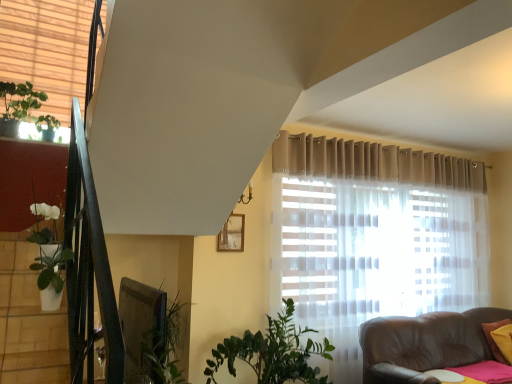
Where is `yellow fabric pillow at lower right`? This screenshot has height=384, width=512. yellow fabric pillow at lower right is located at coordinates (493, 340).

Measure the distance between white glossy pot at left and camera.

The distance of white glossy pot at left from camera is 2.20 meters.

This screenshot has height=384, width=512. Find the location of `beige fabric blinds at upper left`. beige fabric blinds at upper left is located at coordinates (47, 51).

Is yellow fabric pillow at lower right positioned behind green matte plant at upper left?

Yes, yellow fabric pillow at lower right is further from the camera.

Is yellow fabric pillow at lower right taller than green matte plant at upper left?

Incorrect, the height of yellow fabric pillow at lower right is not larger of that of green matte plant at upper left.

Image resolution: width=512 pixels, height=384 pixels. What are the coordinates of `pillow beneath the green matte plant at upper left (from a real-world perspective)` in the screenshot? It's located at (493, 340).

Which is more to the left, yellow fabric pillow at lower right or green matte plant at upper left?

green matte plant at upper left is more to the left.

Considering the relative sizes of green matte plant at upper left and beige fabric blinds at upper left in the image provided, is green matte plant at upper left wider than beige fabric blinds at upper left?

No, green matte plant at upper left is not wider than beige fabric blinds at upper left.

Considering the relative sizes of green matte plant at upper left and beige fabric blinds at upper left in the image provided, is green matte plant at upper left shorter than beige fabric blinds at upper left?

Yes, green matte plant at upper left is shorter than beige fabric blinds at upper left.

Considering the relative positions of green matte plant at upper left and beige fabric blinds at upper left in the image provided, is green matte plant at upper left to the right of beige fabric blinds at upper left from the viewer's perspective?

No, green matte plant at upper left is not to the right of beige fabric blinds at upper left.

Is beige fabric blinds at upper left completely or partially inside green matte plant at upper left?

Definitely not — beige fabric blinds at upper left is not inside green matte plant at upper left.

Who is taller, wooden frame at upper center or yellow fabric pillow at lower right?

With more height is yellow fabric pillow at lower right.

Who is bigger, wooden frame at upper center or yellow fabric pillow at lower right?

Bigger between the two is yellow fabric pillow at lower right.

How many degrees apart are the facing directions of wooden frame at upper center and yellow fabric pillow at lower right?

There is a 8.17-degree angle between the facing directions of wooden frame at upper center and yellow fabric pillow at lower right.

Is wooden frame at upper center facing away from green matte plant at upper left?

wooden frame at upper center is not turned away from green matte plant at upper left.

Considering the relative positions of wooden frame at upper center and green matte plant at upper left in the image provided, is wooden frame at upper center to the right of green matte plant at upper left from the viewer's perspective?

Yes.

Is the position of wooden frame at upper center less distant than that of green matte plant at upper left?

No, wooden frame at upper center is behind green matte plant at upper left.

In the scene shown: From a real-world perspective, is wooden frame at upper center on green matte plant at upper left?

No, from a real-world perspective, wooden frame at upper center is not over green matte plant at upper left

Is white glossy pot at left to the left of beige fabric blinds at upper left from the viewer's perspective?

In fact, white glossy pot at left is to the right of beige fabric blinds at upper left.

Considering the sizes of objects white glossy pot at left and beige fabric blinds at upper left in the image provided, who is bigger, white glossy pot at left or beige fabric blinds at upper left?

beige fabric blinds at upper left.

Who is taller, white glossy pot at left or beige fabric blinds at upper left?

Standing taller between the two is beige fabric blinds at upper left.

Which is behind, white glossy pot at left or beige fabric blinds at upper left?

beige fabric blinds at upper left is further away from the camera.

Is beige fabric blinds at upper left positioned far away from wooden frame at upper center?

beige fabric blinds at upper left is positioned a significant distance from wooden frame at upper center.

Which of these two, beige fabric blinds at upper left or wooden frame at upper center, is wider?

With larger width is beige fabric blinds at upper left.

Is point (103, 2) behind point (226, 247)?

No, (103, 2) is in front of (226, 247).

Considering the relative positions of beige fabric blinds at upper left and wooden frame at upper center in the image provided, is beige fabric blinds at upper left to the left or to the right of wooden frame at upper center?

beige fabric blinds at upper left is positioned on wooden frame at upper center's left side.

Based on their positions, is white glossy pot at left located to the left or right of yellow fabric pillow at lower right?

Clearly, white glossy pot at left is on the left of yellow fabric pillow at lower right in the image.

Is white glossy pot at left in contact with yellow fabric pillow at lower right?

No, white glossy pot at left is not with yellow fabric pillow at lower right.

Is white glossy pot at left inside or outside of yellow fabric pillow at lower right?

white glossy pot at left lies outside yellow fabric pillow at lower right.

Is white glossy pot at left turned away from yellow fabric pillow at lower right?

white glossy pot at left is not turned away from yellow fabric pillow at lower right.

This screenshot has width=512, height=384. I want to click on pillow lying below the green matte plant at upper left (from the image's perspective), so click(x=493, y=340).

In the image, there is a green matte plant at upper left. Find the location of `window blind above it (from the image's perspective)`. window blind above it (from the image's perspective) is located at coordinates (47, 51).

When comparing their distances from white glossy pot at left, does green matte plant at upper left or beige fabric blinds at upper left seem closer?

Based on the image, green matte plant at upper left appears to be nearer to white glossy pot at left.

When comparing their distances from green matte plant at upper left, does white glossy pot at left or yellow fabric pillow at lower right seem further?

yellow fabric pillow at lower right is further to green matte plant at upper left.

Based on their spatial positions, is green matte plant at upper left or yellow fabric pillow at lower right further from beige fabric blinds at upper left?

The object further to beige fabric blinds at upper left is yellow fabric pillow at lower right.

Estimate the real-world distances between objects in this image. Which object is further from white glossy pot at left, wooden frame at upper center or yellow fabric pillow at lower right?

yellow fabric pillow at lower right lies further to white glossy pot at left than the other object.

Which object lies nearer to the anchor point wooden frame at upper center, yellow fabric pillow at lower right or green matte plant at upper left?

green matte plant at upper left lies closer to wooden frame at upper center than the other object.

From the image, which object appears to be farther from yellow fabric pillow at lower right, green matte plant at upper left or wooden frame at upper center?

green matte plant at upper left is positioned further to the anchor yellow fabric pillow at lower right.

Based on their spatial positions, is yellow fabric pillow at lower right or beige fabric blinds at upper left closer to wooden frame at upper center?

beige fabric blinds at upper left lies closer to wooden frame at upper center than the other object.

Looking at the image, which one is located further to beige fabric blinds at upper left, white glossy pot at left or yellow fabric pillow at lower right?

yellow fabric pillow at lower right is further to beige fabric blinds at upper left.

Where is `window blind between green matte plant at upper left and yellow fabric pillow at lower right from left to right`? This screenshot has width=512, height=384. window blind between green matte plant at upper left and yellow fabric pillow at lower right from left to right is located at coordinates (47, 51).

Find the location of a particular element. Image resolution: width=512 pixels, height=384 pixels. picture frame located between white glossy pot at left and yellow fabric pillow at lower right in the left-right direction is located at coordinates (232, 234).

Where is `picture frame situated between green matte plant at upper left and yellow fabric pillow at lower right from left to right`? The height and width of the screenshot is (384, 512). picture frame situated between green matte plant at upper left and yellow fabric pillow at lower right from left to right is located at coordinates (232, 234).

Find the location of `houseplant between beige fabric blinds at upper left and white glossy pot at left in the vertical direction`. houseplant between beige fabric blinds at upper left and white glossy pot at left in the vertical direction is located at coordinates (23, 109).